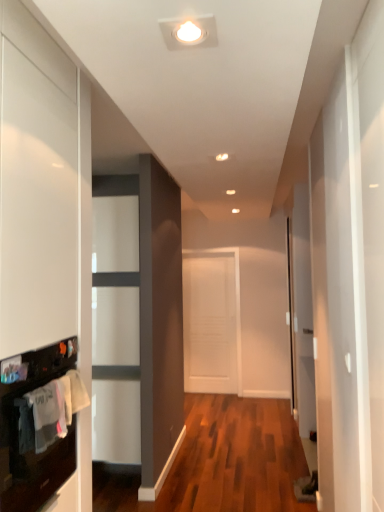
Question: Is the depth of white cotton laundry at left less than that of white matte door at center?

Choices:
 (A) yes
 (B) no

Answer: (A)

Question: Can you confirm if white cotton laundry at left is smaller than white matte door at center?

Choices:
 (A) no
 (B) yes

Answer: (B)

Question: Is white cotton laundry at left directly adjacent to white matte door at center?

Choices:
 (A) yes
 (B) no

Answer: (B)

Question: Could white matte door at center be considered to be inside white cotton laundry at left?

Choices:
 (A) yes
 (B) no

Answer: (B)

Question: Considering the relative sizes of white cotton laundry at left and white matte door at center in the image provided, is white cotton laundry at left bigger than white matte door at center?

Choices:
 (A) no
 (B) yes

Answer: (A)

Question: Is there a large distance between white cotton laundry at left and white matte door at center?

Choices:
 (A) yes
 (B) no

Answer: (A)

Question: Is white cotton laundry at left looking in the opposite direction of black glossy oven at lower left?

Choices:
 (A) yes
 (B) no

Answer: (A)

Question: From the image's perspective, is white cotton laundry at left under black glossy oven at lower left?

Choices:
 (A) yes
 (B) no

Answer: (B)

Question: Is white cotton laundry at left taller than black glossy oven at lower left?

Choices:
 (A) no
 (B) yes

Answer: (A)

Question: Is white cotton laundry at left surrounding black glossy oven at lower left?

Choices:
 (A) no
 (B) yes

Answer: (A)

Question: Are white cotton laundry at left and black glossy oven at lower left located far from each other?

Choices:
 (A) no
 (B) yes

Answer: (A)

Question: Considering the relative sizes of white cotton laundry at left and black glossy oven at lower left in the image provided, is white cotton laundry at left shorter than black glossy oven at lower left?

Choices:
 (A) yes
 (B) no

Answer: (A)

Question: Is black glossy oven at lower left shorter than white matte door at center?

Choices:
 (A) no
 (B) yes

Answer: (B)